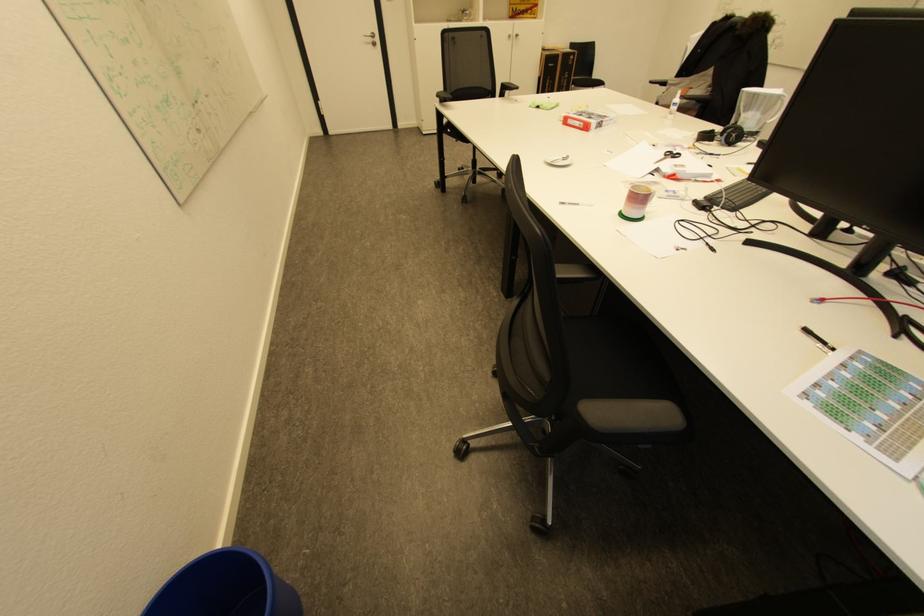
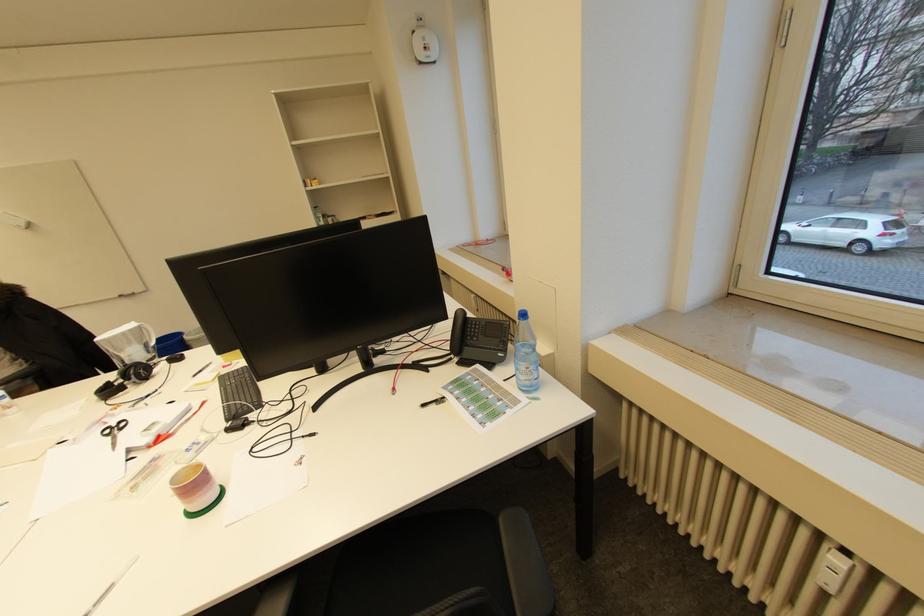
Where in the second image is the point corresponding to (685,154) from the first image?

(127, 422)